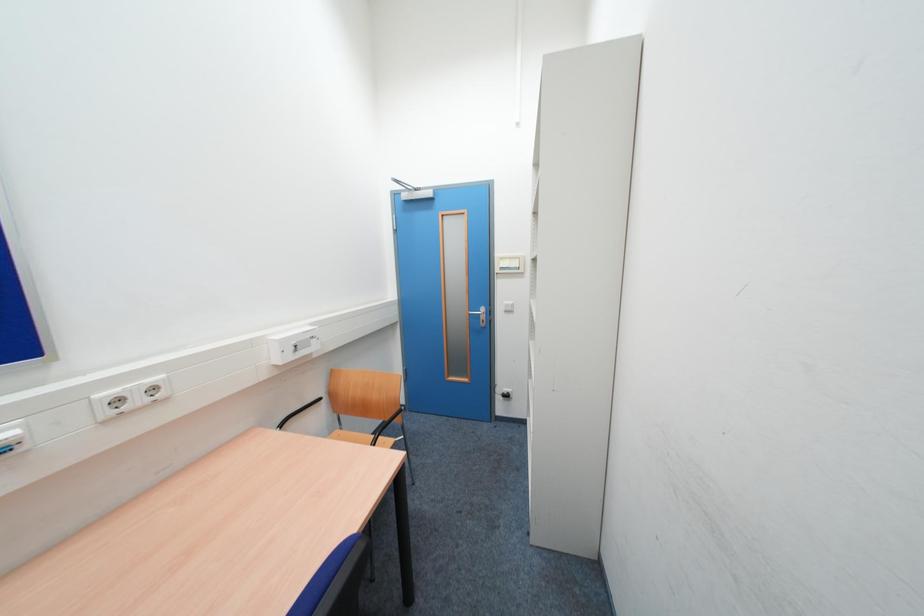
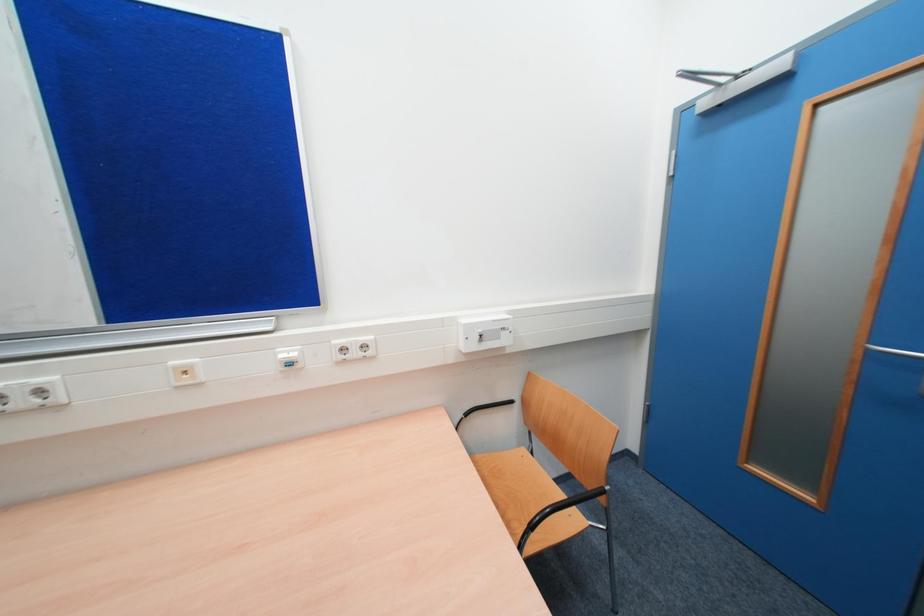
Question: The camera is either moving clockwise (left) or counter-clockwise (right) around the object. The first image is from the beginning of the video and the second image is from the end. Is the camera moving left or right when shooting the video?

Choices:
 (A) Left
 (B) Right

Answer: (B)